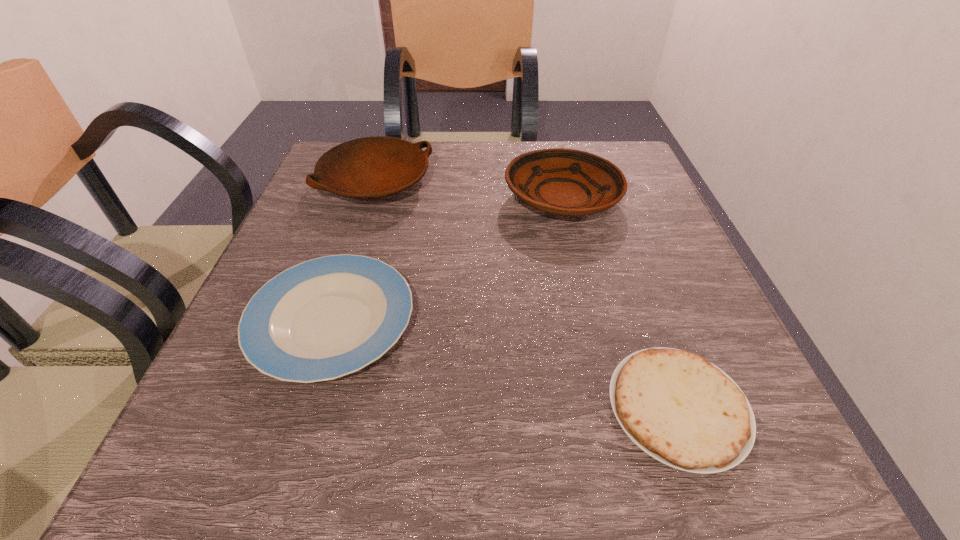
This screenshot has width=960, height=540. What are the coordinates of `object at the far right corner` in the screenshot? It's located at (567, 182).

You are a GUI agent. You are given a task and a screenshot of the screen. Output one action in this format:
    pyautogui.click(x=<x>, y=<y>)
    Task: Click on the object that is at the near right corner
    Image resolution: width=960 pixels, height=540 pixels.
    Given the screenshot: What is the action you would take?
    pyautogui.click(x=684, y=411)

Find the location of a particular element. This screenshot has width=960, height=540. vacant space at the far edge of the desktop is located at coordinates (494, 192).

At what (x,y) coordinates should I click in order to perform the action: click on free location at the near edge of the desktop. Please return your answer as a coordinate pair (x, y). Looking at the image, I should click on (440, 489).

The image size is (960, 540). In the image, there is a desktop. What are the coordinates of `vacant area at the left edge` in the screenshot? It's located at (281, 398).

At what (x,y) coordinates should I click in order to perform the action: click on vacant space at the right edge. Please return your answer as a coordinate pair (x, y). This screenshot has width=960, height=540. Looking at the image, I should click on click(x=686, y=294).

Identify the location of blank space at the far right corner of the desktop. The height and width of the screenshot is (540, 960). (655, 191).

The height and width of the screenshot is (540, 960). Find the location of `unoccupied area between the rightmost plate and the shortest plate`. unoccupied area between the rightmost plate and the shortest plate is located at coordinates (447, 261).

Where is `vacant area between the tortilla and the rightmost plate`? This screenshot has height=540, width=960. vacant area between the tortilla and the rightmost plate is located at coordinates (620, 303).

You are a GUI agent. You are given a task and a screenshot of the screen. Output one action in this format:
    pyautogui.click(x=<x>, y=<y>)
    Task: Click on the empty location between the nearest plate and the rightmost plate
    Image resolution: width=960 pixels, height=540 pixels.
    Given the screenshot: What is the action you would take?
    pyautogui.click(x=447, y=261)